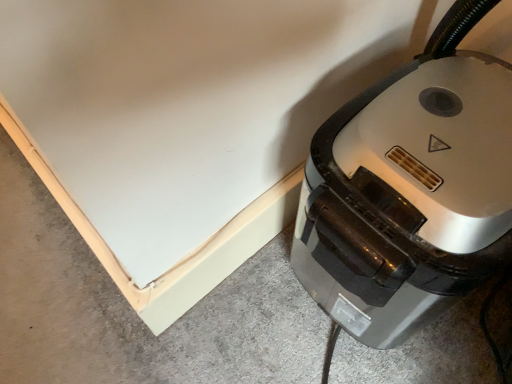
What do you see at coordinates (134, 312) in the screenshot?
I see `gray concrete at lower left` at bounding box center [134, 312].

Where is `gray concrete at lower left`? gray concrete at lower left is located at coordinates (134, 312).

Describe the element at coordinates (408, 197) in the screenshot. I see `metallic gray vacuum cleaner at lower right` at that location.

The width and height of the screenshot is (512, 384). I want to click on metallic gray vacuum cleaner at lower right, so click(408, 197).

Where is `gray concrete at lower left`? gray concrete at lower left is located at coordinates (134, 312).

Based on their positions, is gray concrete at lower left located to the left or right of metallic gray vacuum cleaner at lower right?

From the image, it's evident that gray concrete at lower left is to the left of metallic gray vacuum cleaner at lower right.

Does gray concrete at lower left lie behind metallic gray vacuum cleaner at lower right?

Yes.

Is point (72, 348) closer to viewer compared to point (448, 209)?

No, (72, 348) is further to viewer.

From the image's perspective, between gray concrete at lower left and metallic gray vacuum cleaner at lower right, which one is located above?

From the image's view, gray concrete at lower left is above.

From a real-world perspective, who is located lower, gray concrete at lower left or metallic gray vacuum cleaner at lower right?

gray concrete at lower left, from a real-world perspective.

Based on the photo, does gray concrete at lower left have a greater width compared to metallic gray vacuum cleaner at lower right?

Yes.

Which of these two, gray concrete at lower left or metallic gray vacuum cleaner at lower right, stands shorter?

gray concrete at lower left is shorter.

Considering the sizes of objects gray concrete at lower left and metallic gray vacuum cleaner at lower right in the image provided, who is smaller, gray concrete at lower left or metallic gray vacuum cleaner at lower right?

With smaller size is gray concrete at lower left.

Is metallic gray vacuum cleaner at lower right a part of gray concrete at lower left?

No, metallic gray vacuum cleaner at lower right is not a part of gray concrete at lower left.

Can you see gray concrete at lower left touching metallic gray vacuum cleaner at lower right?

No, gray concrete at lower left is not beside metallic gray vacuum cleaner at lower right.

Could you tell me if gray concrete at lower left is turned towards metallic gray vacuum cleaner at lower right?

No, gray concrete at lower left is not oriented towards metallic gray vacuum cleaner at lower right.

The height and width of the screenshot is (384, 512). Identify the location of home appliance below the gray concrete at lower left (from the image's perspective). (408, 197).

Which is more to the left, metallic gray vacuum cleaner at lower right or gray concrete at lower left?

gray concrete at lower left is more to the left.

In the image, is metallic gray vacuum cleaner at lower right positioned in front of or behind gray concrete at lower left?

metallic gray vacuum cleaner at lower right is positioned closer to the viewer than gray concrete at lower left.

Considering the points (398, 95) and (84, 370), which point is behind, point (398, 95) or point (84, 370)?

The point (84, 370) is farther.

Consider the image. From the image's perspective, is metallic gray vacuum cleaner at lower right above gray concrete at lower left?

No.

From a real-world perspective, is metallic gray vacuum cleaner at lower right on gray concrete at lower left?

Correct, in the physical world, metallic gray vacuum cleaner at lower right is higher than gray concrete at lower left.

Is metallic gray vacuum cleaner at lower right wider or thinner than gray concrete at lower left?

Clearly, metallic gray vacuum cleaner at lower right has less width compared to gray concrete at lower left.

Who is shorter, metallic gray vacuum cleaner at lower right or gray concrete at lower left?

gray concrete at lower left.

Is metallic gray vacuum cleaner at lower right smaller than gray concrete at lower left?

Actually, metallic gray vacuum cleaner at lower right might be larger than gray concrete at lower left.

Based on the photo, could gray concrete at lower left be considered to be inside metallic gray vacuum cleaner at lower right?

No, gray concrete at lower left is not a part of metallic gray vacuum cleaner at lower right.

Would you say metallic gray vacuum cleaner at lower right is a long distance from gray concrete at lower left?

No, metallic gray vacuum cleaner at lower right is in close proximity to gray concrete at lower left.

Does metallic gray vacuum cleaner at lower right turn towards gray concrete at lower left?

No, metallic gray vacuum cleaner at lower right is not oriented towards gray concrete at lower left.

What's the angular difference between metallic gray vacuum cleaner at lower right and gray concrete at lower left's facing directions?

The facing directions of metallic gray vacuum cleaner at lower right and gray concrete at lower left are 90.1 degrees apart.

Measure the distance between metallic gray vacuum cleaner at lower right and gray concrete at lower left.

A distance of 10.30 inches exists between metallic gray vacuum cleaner at lower right and gray concrete at lower left.

Locate an element on the screen. The height and width of the screenshot is (384, 512). home appliance lying below the gray concrete at lower left (from the image's perspective) is located at coordinates (408, 197).

The height and width of the screenshot is (384, 512). Find the location of `home appliance that is below the gray concrete at lower left (from the image's perspective)`. home appliance that is below the gray concrete at lower left (from the image's perspective) is located at coordinates (408, 197).

The width and height of the screenshot is (512, 384). Identify the location of home appliance to the right of gray concrete at lower left. (408, 197).